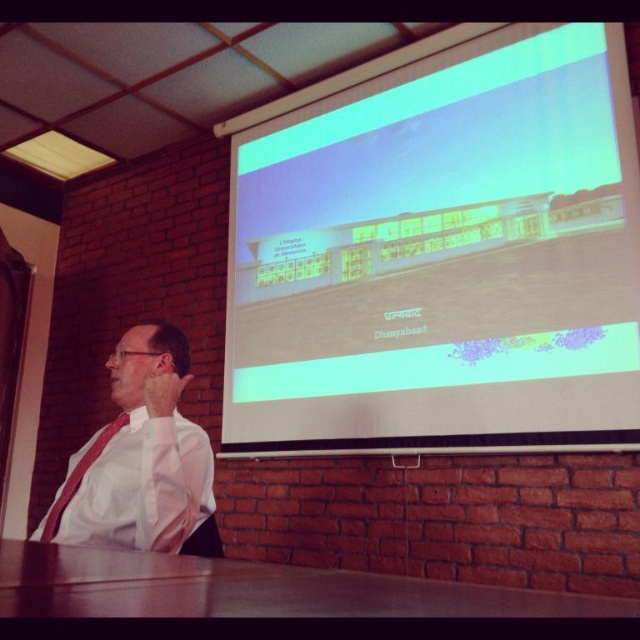
You are a virtual assistant navigating a 3D model of the building shown on the projection screen. You need to move from point A at coordinates point [77,563] to point B at coordinates point [164,385]. Which point is closer to you as you start your journey?

Point point [77,563] is closer to the viewer than point point [164,385], so you will start closer to point A.

In the scene shown: You are a guest speaker at a conference and need to place a 12cm tall nameplate on the brown wooden table at lower center. Considering the height of the white shirt at left, will the nameplate be visible to the audience seated in front of you?

The brown wooden table at lower center is not as tall as the white shirt at left. Since the white shirt at left is taller than the table, the nameplate placed on the table may be partially obscured by the shirt when viewed from the front.

You are standing in the conference room and want to place a coffee mug on the brown wooden table at lower center. The table is at coordinates point (252, 589). If your current position is at point 0.5, 0.5, what direction should you move to reach the table?

You should move towards the point (252, 589) to reach the brown wooden table at lower center.